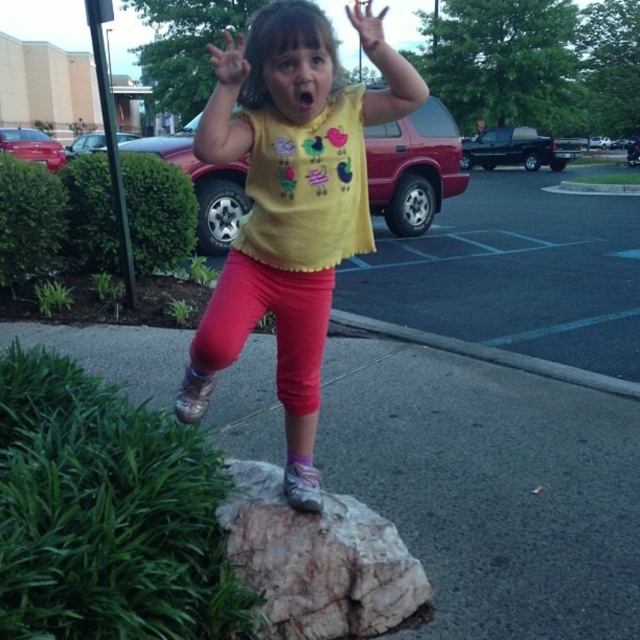
Question: Is gray asphalt pavement at center above matte yellow shirt at center?

Choices:
 (A) yes
 (B) no

Answer: (B)

Question: Can you confirm if gray asphalt pavement at center is positioned to the right of matte yellow shirt at center?

Choices:
 (A) yes
 (B) no

Answer: (B)

Question: Is gray asphalt pavement at center thinner than matte yellow shirt at center?

Choices:
 (A) yes
 (B) no

Answer: (B)

Question: Which point appears farthest from the camera in this image?

Choices:
 (A) (545, 598)
 (B) (362, 141)

Answer: (A)